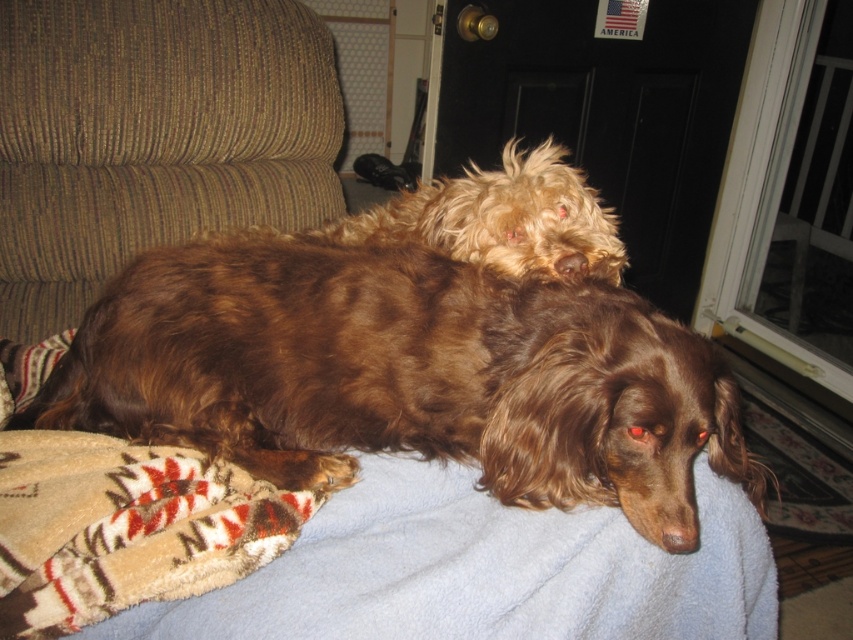
Question: Which of these objects is positioned farthest from the transparent glass door at upper right?

Choices:
 (A) brown corduroy couch at upper left
 (B) brown furry dog at center

Answer: (B)

Question: Which is farther from the brown corduroy couch at upper left?

Choices:
 (A) transparent glass door at upper right
 (B) fuzzy brown dog at upper center

Answer: (A)

Question: Which point is closer to the camera taking this photo?

Choices:
 (A) (376, 241)
 (B) (259, 262)

Answer: (B)

Question: Can you confirm if brown furry dog at center is bigger than brown corduroy couch at upper left?

Choices:
 (A) yes
 (B) no

Answer: (A)

Question: Can you confirm if brown furry dog at center is smaller than fuzzy brown dog at upper center?

Choices:
 (A) no
 (B) yes

Answer: (A)

Question: Does brown furry dog at center have a greater width compared to brown corduroy couch at upper left?

Choices:
 (A) no
 (B) yes

Answer: (B)